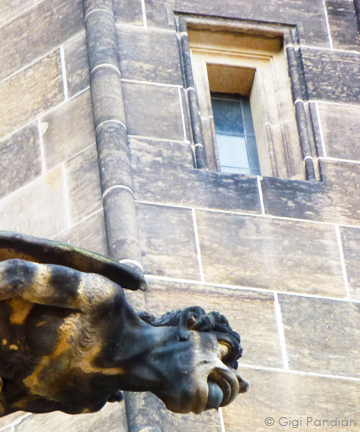
Locate an element on the screen. window is located at coordinates (250, 139).